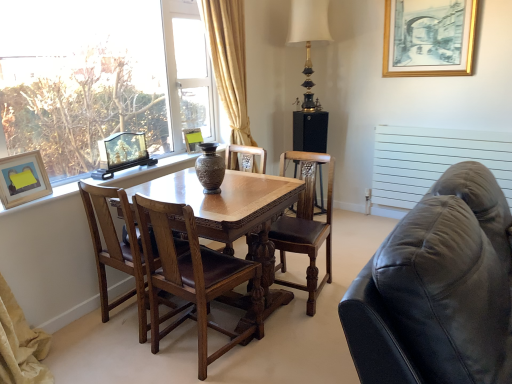
Measure the distance between wooden table at lower center and camera.

They are 7.06 feet apart.

You are a GUI agent. You are given a task and a screenshot of the screen. Output one action in this format:
    pyautogui.click(x=<x>, y=<y>)
    Task: Click on the clear glass window at upper left
    The width and height of the screenshot is (512, 384).
    Given the screenshot: What is the action you would take?
    pyautogui.click(x=100, y=78)

The image size is (512, 384). What do you see at coordinates (116, 248) in the screenshot?
I see `brown leather chair at center, which ranks as the 3th chair in right-to-left order` at bounding box center [116, 248].

The height and width of the screenshot is (384, 512). What do you see at coordinates (305, 225) in the screenshot? I see `mahogany wood chair at center, the third chair from the left` at bounding box center [305, 225].

What is the approximate width of black leather couch at right?

black leather couch at right is 19.76 inches in width.

Where is `wooden table at lower center`? The height and width of the screenshot is (384, 512). wooden table at lower center is located at coordinates (148, 171).

Which is in front, point (6, 185) or point (140, 95)?

The point (6, 185) is closer.

Is wooden picture frame at upper left, positioned as the 4th picture frame in back-to-front order, next to clear glass window at upper left and touching it?

wooden picture frame at upper left, positioned as the 4th picture frame in back-to-front order, and clear glass window at upper left are not in contact.

What's the angular difference between wooden picture frame at upper left, which is the fourth picture frame from top to bottom, and clear glass window at upper left's facing directions?

10.8 degrees separate the facing orientations of wooden picture frame at upper left, which is the fourth picture frame from top to bottom, and clear glass window at upper left.

From the image's perspective, which one is positioned lower, wooden picture frame at upper left, which is the first picture frame from left to right, or clear glass window at upper left?

wooden picture frame at upper left, which is the first picture frame from left to right, is shown below in the image.

From the image's perspective, is wooden picture frame at left, the third picture frame in the top-to-bottom sequence, under black matte speaker at center?

Yes, from the image's perspective, wooden picture frame at left, the third picture frame in the top-to-bottom sequence, is beneath black matte speaker at center.

Is black matte speaker at center at the back of wooden picture frame at left, the second picture frame when ordered from left to right?

wooden picture frame at left, the second picture frame when ordered from left to right, is not turned away from black matte speaker at center.

Which of these two, wooden picture frame at left, the second picture frame when ordered from front to back, or black matte speaker at center, is thinner?

Thinner between the two is wooden picture frame at left, the second picture frame when ordered from front to back.

Is wooden picture frame at left, the 3th picture frame positioned from the back, closer to camera compared to black matte speaker at center?

Yes, wooden picture frame at left, the 3th picture frame positioned from the back, is closer to the camera.

The height and width of the screenshot is (384, 512). I want to click on table lamp above the wooden table at center (from the image's perspective), so click(309, 39).

Measure the distance between wooden table at center and gold-bronze table lamp at upper center.

wooden table at center and gold-bronze table lamp at upper center are 1.86 meters apart from each other.

Between wooden table at center and gold-bronze table lamp at upper center, which one has more height?

gold-bronze table lamp at upper center.

Would you say wooden table at center contains gold-bronze table lamp at upper center?

No, gold-bronze table lamp at upper center is not a part of wooden table at center.

How many degrees apart are the facing directions of matte black picture frame at center, the first picture frame when ordered from back to front, and wooden picture frame at upper left, positioned as the first picture frame in bottom-to-top order?

The facing directions of matte black picture frame at center, the first picture frame when ordered from back to front, and wooden picture frame at upper left, positioned as the first picture frame in bottom-to-top order, are 34.2 degrees apart.

Does matte black picture frame at center, the 3th picture frame from the bottom, come behind wooden picture frame at upper left, the 4th picture frame in the right-to-left sequence?

Yes, matte black picture frame at center, the 3th picture frame from the bottom, is behind wooden picture frame at upper left, the 4th picture frame in the right-to-left sequence.

Which picture frame is the 2nd one when counting from the right side of the wooden picture frame at upper left, positioned as the first picture frame in front-to-back order? Please provide its 2D coordinates.

[(192, 139)]

Does matte black picture frame at center, which is the second picture frame from top to bottom, turn towards wooden picture frame at upper left, positioned as the first picture frame in front-to-back order?

No, matte black picture frame at center, which is the second picture frame from top to bottom, is not facing towards wooden picture frame at upper left, positioned as the first picture frame in front-to-back order.

Is wooden picture frame at upper left, positioned as the first picture frame in bottom-to-top order, smaller than wooden table at lower center?

Yes, wooden picture frame at upper left, positioned as the first picture frame in bottom-to-top order, is smaller than wooden table at lower center.

Would you say wooden table at lower center is part of wooden picture frame at upper left, positioned as the first picture frame in bottom-to-top order,'s contents?

No.

What's the angular difference between wooden picture frame at upper left, positioned as the first picture frame in front-to-back order, and wooden table at lower center's facing directions?

The angular difference between wooden picture frame at upper left, positioned as the first picture frame in front-to-back order, and wooden table at lower center is 10.5 degrees.

From a real-world perspective, is wooden picture frame at upper left, positioned as the first picture frame in bottom-to-top order, positioned above or below wooden table at lower center?

wooden picture frame at upper left, positioned as the first picture frame in bottom-to-top order, is situated higher than wooden table at lower center in the real world.

Is wooden picture frame at upper left, which is the first picture frame from left to right, oriented away from black leather couch at right?

No.

Which of these two, wooden picture frame at upper left, which is the fourth picture frame from top to bottom, or black leather couch at right, is smaller?

wooden picture frame at upper left, which is the fourth picture frame from top to bottom.

Considering the sizes of wooden picture frame at upper left, which is the fourth picture frame from top to bottom, and black leather couch at right in the image, is wooden picture frame at upper left, which is the fourth picture frame from top to bottom, wider or thinner than black leather couch at right?

Clearly, wooden picture frame at upper left, which is the fourth picture frame from top to bottom, has less width compared to black leather couch at right.

In terms of width, does wooden picture frame at upper left, positioned as the first picture frame in front-to-back order, look wider or thinner when compared to wooden picture frame at left, placed as the second picture frame when sorted from bottom to top?

Clearly, wooden picture frame at upper left, positioned as the first picture frame in front-to-back order, has less width compared to wooden picture frame at left, placed as the second picture frame when sorted from bottom to top.

Who is smaller, wooden picture frame at upper left, which is the first picture frame from left to right, or wooden picture frame at left, the second picture frame when ordered from left to right?

wooden picture frame at upper left, which is the first picture frame from left to right, is smaller.

From a real-world perspective, is wooden picture frame at upper left, which is the fourth picture frame from top to bottom, physically below wooden picture frame at left, which appears as the third picture frame when viewed from the right?

Yes, from a real-world perspective, wooden picture frame at upper left, which is the fourth picture frame from top to bottom, is beneath wooden picture frame at left, which appears as the third picture frame when viewed from the right.

Between wooden picture frame at upper left, positioned as the first picture frame in front-to-back order, and wooden picture frame at left, placed as the second picture frame when sorted from bottom to top, which one is positioned behind?

wooden picture frame at left, placed as the second picture frame when sorted from bottom to top, is behind.

At what (x,y) coordinates should I click in order to perform the action: click on window that appears in front of the wooden picture frame at upper left, positioned as the first picture frame in front-to-back order. Please return your answer as a coordinate pair (x, y). Looking at the image, I should click on (100, 78).

Image resolution: width=512 pixels, height=384 pixels. In order to click on speaker behind the wooden picture frame at left, the 3th picture frame positioned from the back in this screenshot , I will do `click(310, 131)`.

Looking at the image, which one is located closer to white matte radiator at right, gold-framed print at upper right, the fourth picture frame ordered from the bottom, or black matte speaker at center?

Among the two, gold-framed print at upper right, the fourth picture frame ordered from the bottom, is located nearer to white matte radiator at right.

From the image, which object appears to be nearer to black matte speaker at center, clear glass window at upper left or wooden table at lower center?

Among the two, wooden table at lower center is located nearer to black matte speaker at center.

Considering their positions, is brown leather chair at center, which ranks as the 3th chair in right-to-left order, positioned closer to white matte radiator at right than black matte speaker at center?

black matte speaker at center is positioned closer to the anchor white matte radiator at right.

From the image, which object appears to be farther from mahogany wood chair at center, the third chair from the left, clear glass window at upper left or wooden table at center?

clear glass window at upper left lies further to mahogany wood chair at center, the third chair from the left, than the other object.

Estimate the real-world distances between objects in this image. Which object is closer to brown leather chair at center, which ranks as the 3th chair in right-to-left order, matte black picture frame at center, the 3th picture frame from the bottom, or black matte speaker at center?

Among the two, matte black picture frame at center, the 3th picture frame from the bottom, is located nearer to brown leather chair at center, which ranks as the 3th chair in right-to-left order.

Looking at the image, which one is located further to black leather couch at right, black matte speaker at center or white matte radiator at right?

Among the two, black matte speaker at center is located further to black leather couch at right.

Estimate the real-world distances between objects in this image. Which object is closer to wooden table at lower center, wooden picture frame at upper left, positioned as the first picture frame in front-to-back order, or brown leather chair at center, which appears as the first chair when viewed from the left?

wooden picture frame at upper left, positioned as the first picture frame in front-to-back order, is positioned closer to the anchor wooden table at lower center.

Based on their spatial positions, is black leather couch at right or white matte radiator at right further from brown leather chair at center, which ranks as the 3th chair in right-to-left order?

Based on the image, white matte radiator at right appears to be further to brown leather chair at center, which ranks as the 3th chair in right-to-left order.

At what (x,y) coordinates should I click in order to perform the action: click on kitchen & dining room table situated between brown leather chair at center, which ranks as the 3th chair in right-to-left order, and mahogany wood chair at center, the first chair positioned from the right, from left to right. Please return your answer as a coordinate pair (x, y). The image size is (512, 384). Looking at the image, I should click on (225, 202).

Locate an element on the screen. The height and width of the screenshot is (384, 512). table lamp between matte black picture frame at center, the 2th picture frame when ordered from right to left, and white matte radiator at right from left to right is located at coordinates (309, 39).

Locate an element on the screen. The image size is (512, 384). table lamp situated between brown leather chair at center, which ranks as the 3th chair in right-to-left order, and gold-framed print at upper right, which is counted as the fourth picture frame, starting from the left, from left to right is located at coordinates (309, 39).

Where is `window sill that lies between clear glass window at upper left and wooden picture frame at upper left, positioned as the 4th picture frame in back-to-front order, from top to bottom`? window sill that lies between clear glass window at upper left and wooden picture frame at upper left, positioned as the 4th picture frame in back-to-front order, from top to bottom is located at coordinates (148, 171).